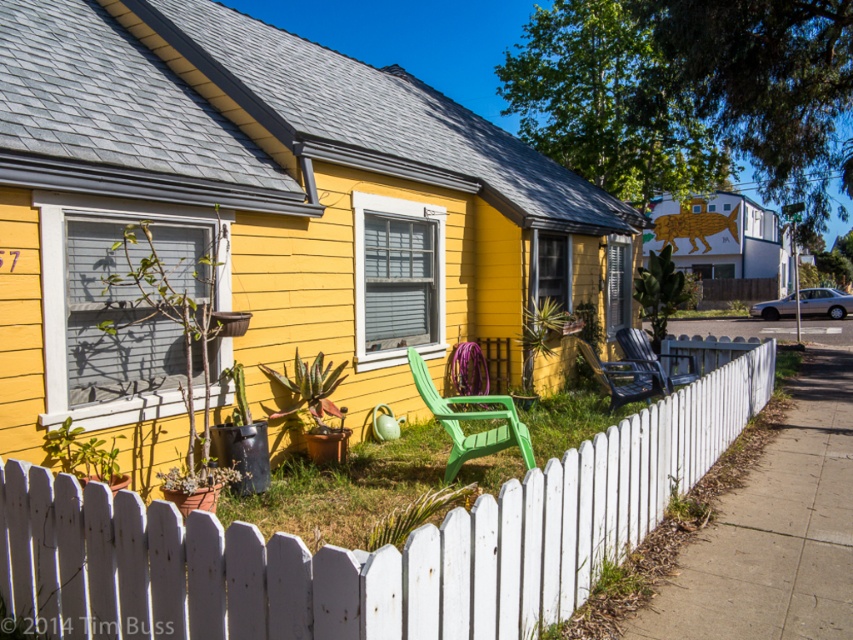
You are planning to place both the green plastic chair at center and the black plastic chair at center in a row along the garden path. If you want to arrange them so that the wider chair is on the left side, which chair should be placed on the left?

The green plastic chair at center should be placed on the left since it is wider than the black plastic chair at center.

You are a delivery person trying to place a large package in the front yard. The package is 1.2 meters wide. You see the white picket fence at center and the black plastic chair at center. Which object can the package fit next to without overlapping?

The package can fit next to the black plastic chair at center because the black plastic chair at center is wider than the white picket fence at center, providing more space.